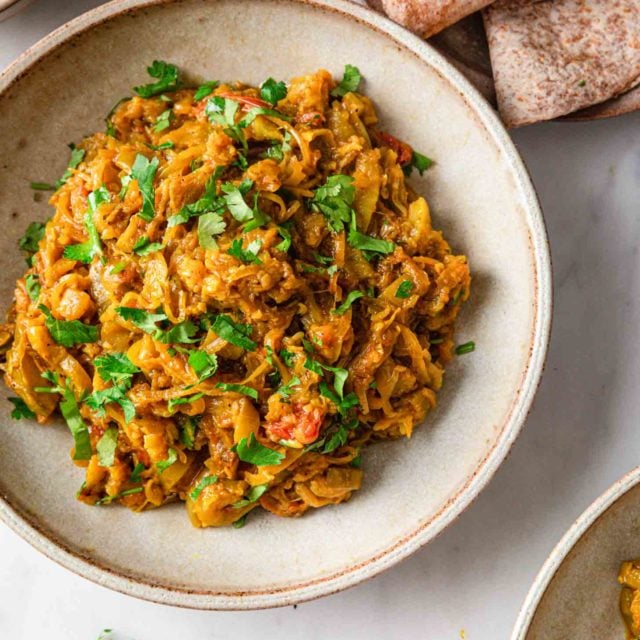
Where is `decorative line`? The height and width of the screenshot is (640, 640). decorative line is located at coordinates pyautogui.click(x=601, y=514).